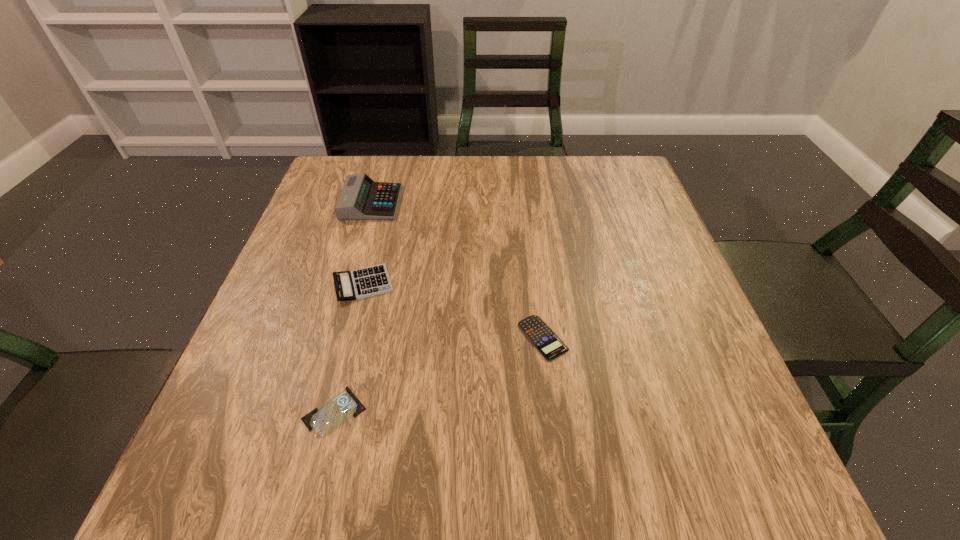
Locate an element on the screen. vacant space at the near left corner is located at coordinates (302, 455).

At what (x,y) coordinates should I click in order to perform the action: click on vacant point located between the farthest object and the rightmost calculator. Please return your answer as a coordinate pair (x, y). The image size is (960, 540). Looking at the image, I should click on (457, 270).

Where is `vacant space that is in between the shortest calculator and the farthest object`? This screenshot has width=960, height=540. vacant space that is in between the shortest calculator and the farthest object is located at coordinates (457, 270).

Image resolution: width=960 pixels, height=540 pixels. I want to click on vacant space that is in between the second farthest calculator and the rightmost calculator, so click(453, 311).

In order to click on empty location between the tallest object and the third tallest object in this screenshot , I will do (x=457, y=270).

You are a GUI agent. You are given a task and a screenshot of the screen. Output one action in this format:
    pyautogui.click(x=<x>, y=<y>)
    Task: Click on the free point between the nearest object and the second shortest calculator
    Image resolution: width=960 pixels, height=540 pixels.
    Given the screenshot: What is the action you would take?
    pyautogui.click(x=348, y=348)

Find the location of a particular element. This screenshot has height=540, width=960. unoccupied position between the nearest object and the farthest object is located at coordinates (353, 307).

Locate an element on the screen. free spot between the farthest calculator and the nearest calculator is located at coordinates [x=457, y=270].

Find the location of a particular element. This screenshot has height=540, width=960. free point between the farthest object and the shortest calculator is located at coordinates (457, 270).

Identify the location of unoccupied area between the shortest calculator and the identity card. This screenshot has height=540, width=960. tap(439, 375).